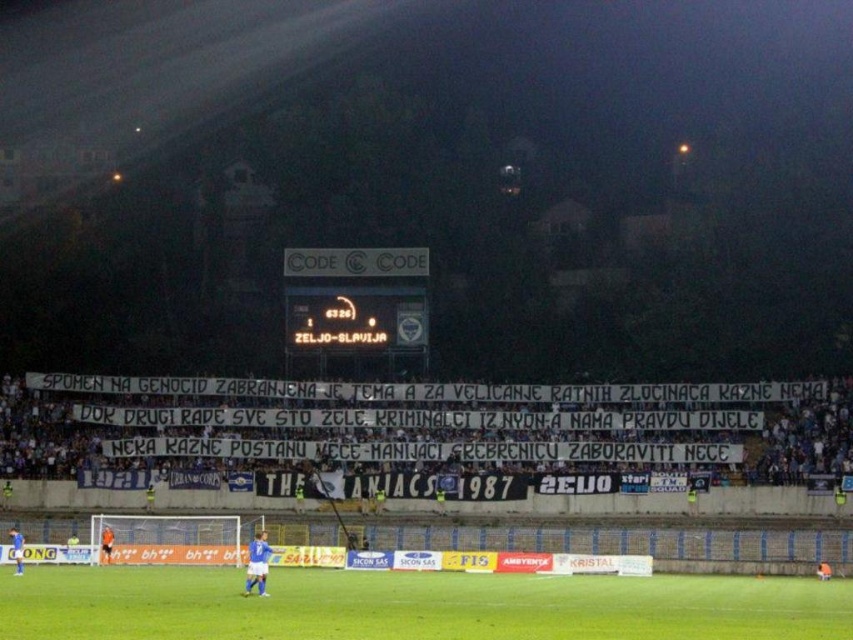
Question: Is white fabric banner at center above green grass field at center?

Choices:
 (A) no
 (B) yes

Answer: (B)

Question: Does white fabric banner at center appear on the left side of green grass field at center?

Choices:
 (A) no
 (B) yes

Answer: (A)

Question: Which point is farther from the camera taking this photo?

Choices:
 (A) (376, 484)
 (B) (650, 612)

Answer: (A)

Question: Is white fabric banner at center thinner than green grass field at center?

Choices:
 (A) yes
 (B) no

Answer: (B)

Question: Which point appears closest to the camera in this image?

Choices:
 (A) (770, 582)
 (B) (805, 420)

Answer: (A)